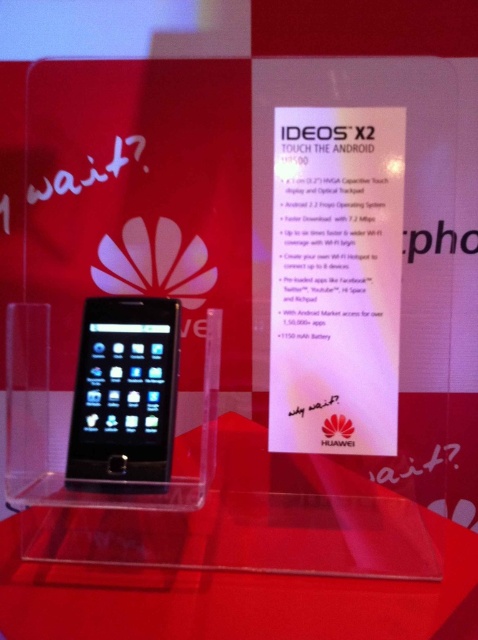
Question: Is the position of transparent acrylic table at center less distant than that of sleek black phone at center?

Choices:
 (A) yes
 (B) no

Answer: (A)

Question: Which of the following is the farthest from the observer?

Choices:
 (A) (x=224, y=598)
 (B) (x=98, y=401)

Answer: (B)

Question: Is transparent acrylic table at center thinner than sleek black phone at center?

Choices:
 (A) no
 (B) yes

Answer: (A)

Question: From the image, what is the correct spatial relationship of transparent acrylic table at center in relation to sleek black phone at center?

Choices:
 (A) left
 (B) right

Answer: (B)

Question: Which point is closer to the camera taking this photo?

Choices:
 (A) (108, 376)
 (B) (85, 621)

Answer: (B)